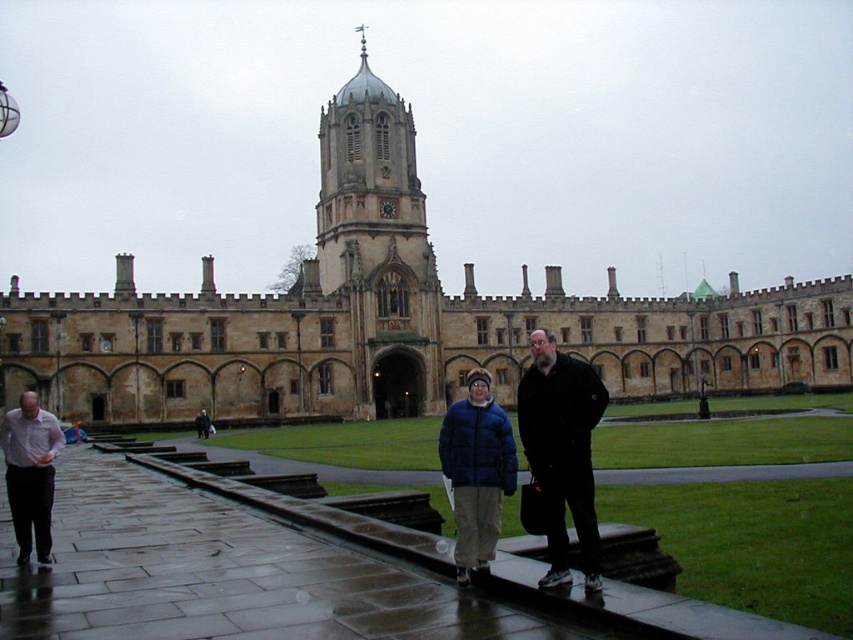
Question: Can you confirm if brown stone church at center is smaller than matte pink shirt at left?

Choices:
 (A) no
 (B) yes

Answer: (A)

Question: Which of the following is the closest to the observer?

Choices:
 (A) matte pink shirt at left
 (B) matte blue puffer jacket at center

Answer: (B)

Question: Which of these objects is positioned closest to the matte blue puffer jacket at center?

Choices:
 (A) matte pink shirt at left
 (B) brown stone church at center
 (C) black matte jacket at center

Answer: (C)

Question: Does brown stone church at center lie behind matte pink shirt at left?

Choices:
 (A) no
 (B) yes

Answer: (B)

Question: Can you confirm if brown stone church at center is positioned to the right of black matte jacket at center?

Choices:
 (A) yes
 (B) no

Answer: (B)

Question: Based on their relative distances, which object is farther from the black matte jacket at center?

Choices:
 (A) matte pink shirt at left
 (B) brown stone church at center
 (C) matte blue puffer jacket at center

Answer: (A)